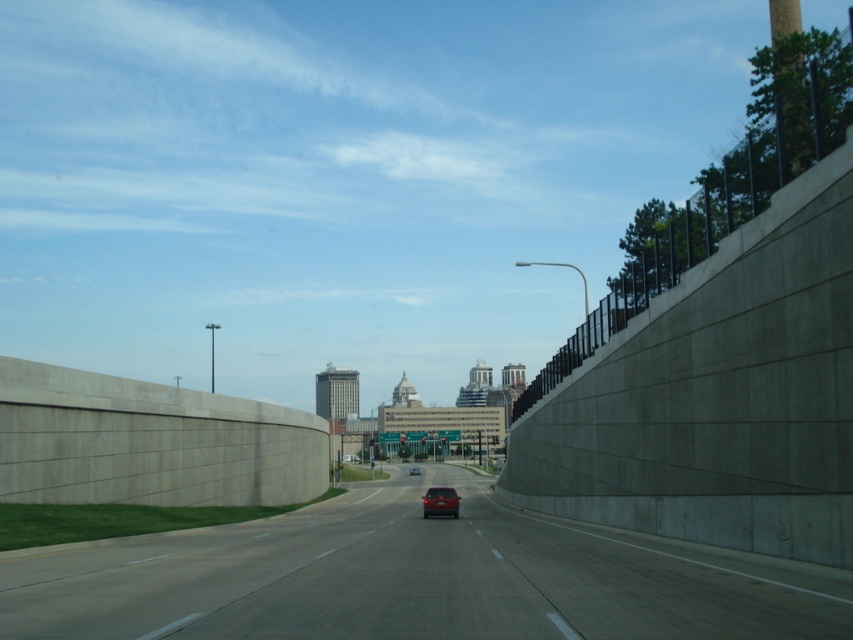
Does smooth asphalt highway at center come behind matte red car at center?

No, it is not.

Where is `smooth asphalt highway at center`? Image resolution: width=853 pixels, height=640 pixels. smooth asphalt highway at center is located at coordinates (416, 579).

Is point (248, 554) behind point (418, 472)?

That is False.

The height and width of the screenshot is (640, 853). I want to click on smooth asphalt highway at center, so click(x=416, y=579).

Is shiny red sedan at center closer to the viewer compared to matte red car at center?

Yes, shiny red sedan at center is closer to the viewer.

Who is more distant from viewer, [447,497] or [416,472]?

Point [416,472]

I want to click on shiny red sedan at center, so click(x=440, y=500).

Is smooth asphalt highway at center taller than shiny red sedan at center?

Correct, smooth asphalt highway at center is much taller as shiny red sedan at center.

Which is in front, point (488, 572) or point (422, 500)?

Point (488, 572) is more forward.

The height and width of the screenshot is (640, 853). Identify the location of smooth asphalt highway at center. (416, 579).